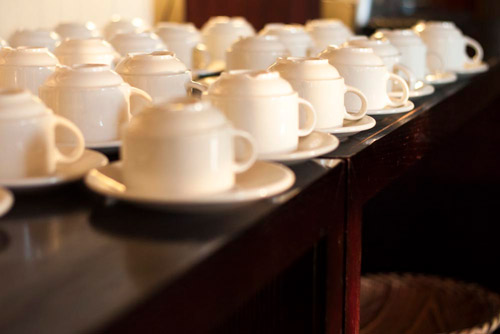
Locate an element on the screen. handle is located at coordinates (77, 130), (142, 96), (247, 131), (316, 114), (359, 100), (410, 91), (443, 66), (480, 54).